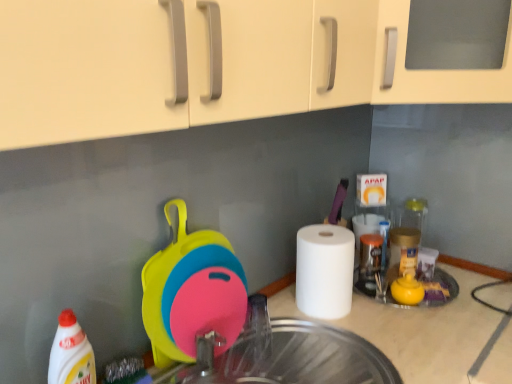
The image size is (512, 384). Identify the location of free region on the left part of metallic silver faucet at center. coord(233,352).